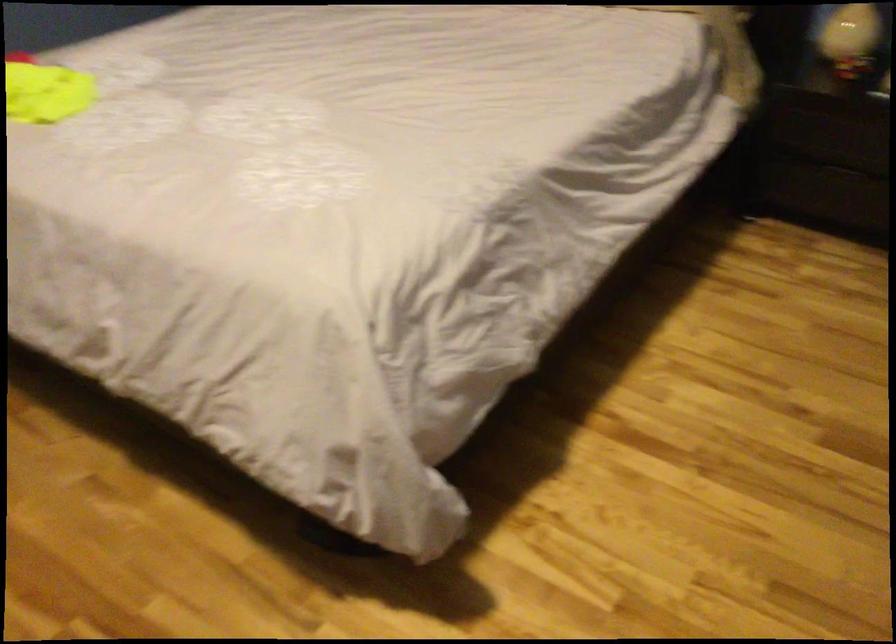
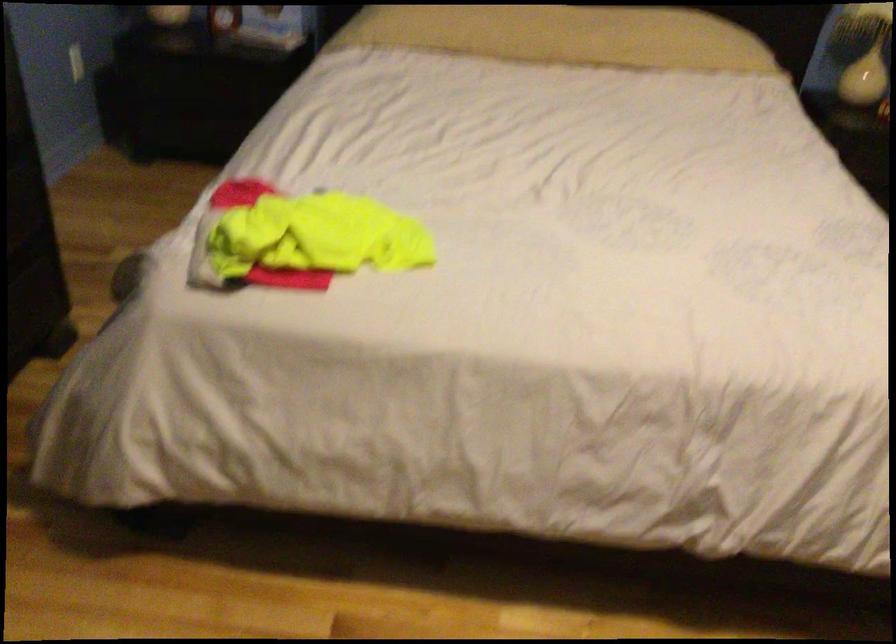
Question: What movement of the cameraman would produce the second image?

Choices:
 (A) Left
 (B) Right
 (C) Forward
 (D) Backward

Answer: (A)